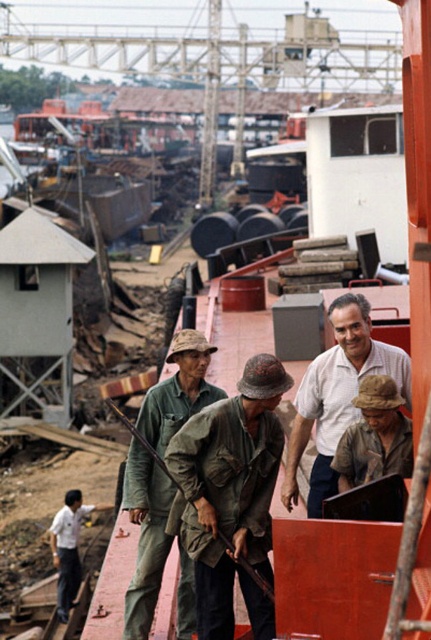
Question: Considering the real-world distances, which object is farthest from the camouflage fabric uniform at center?

Choices:
 (A) green camouflage uniform at lower left
 (B) brown fabric hat at center

Answer: (A)

Question: Does camouflage fabric uniform at center appear on the right side of white cotton shirt at center?

Choices:
 (A) yes
 (B) no

Answer: (B)

Question: Observing the image, what is the correct spatial positioning of camouflage fabric hat at center in reference to green camouflage uniform at lower left?

Choices:
 (A) below
 (B) above

Answer: (B)

Question: Does white cotton shirt at center appear on the left side of green camouflage uniform at lower left?

Choices:
 (A) yes
 (B) no

Answer: (B)

Question: Which of the following is the farthest from the observer?

Choices:
 (A) white cotton shirt at center
 (B) camouflage fabric uniform at center

Answer: (A)

Question: Which of the following is the farthest from the observer?

Choices:
 (A) camouflage fabric hat at center
 (B) white cotton shirt at center
 (C) brown fabric hat at center

Answer: (A)